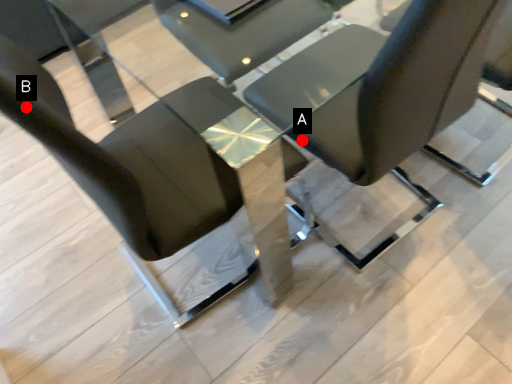
Question: Two points are circled on the image, labeled by A and B beside each circle. Which point appears farthest from the camera in this image?

Choices:
 (A) A is further
 (B) B is further

Answer: (A)